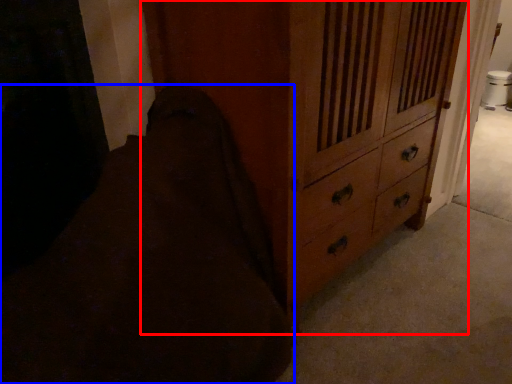
Question: Which of the following is the closest to the observer, chest of drawers (highlighted by a red box) or bedding (highlighted by a blue box)?

Choices:
 (A) chest of drawers
 (B) bedding

Answer: (B)